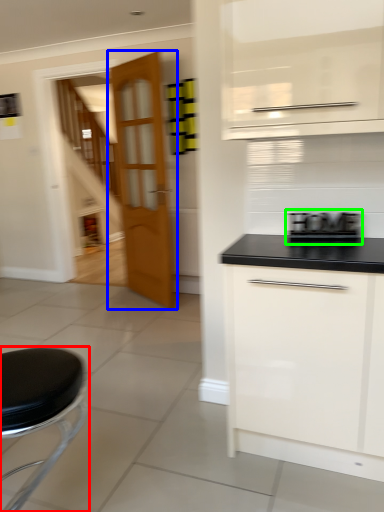
Question: Considering the real-world distances, which object is farthest from furniture (highlighted by a red box)? door (highlighted by a blue box) or appliance (highlighted by a green box)?

Choices:
 (A) door
 (B) appliance

Answer: (A)